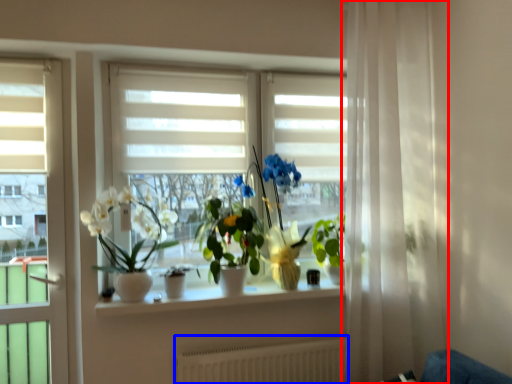
Question: Which object is further to the camera taking this photo, curtain (highlighted by a red box) or radiator (highlighted by a blue box)?

Choices:
 (A) curtain
 (B) radiator

Answer: (B)